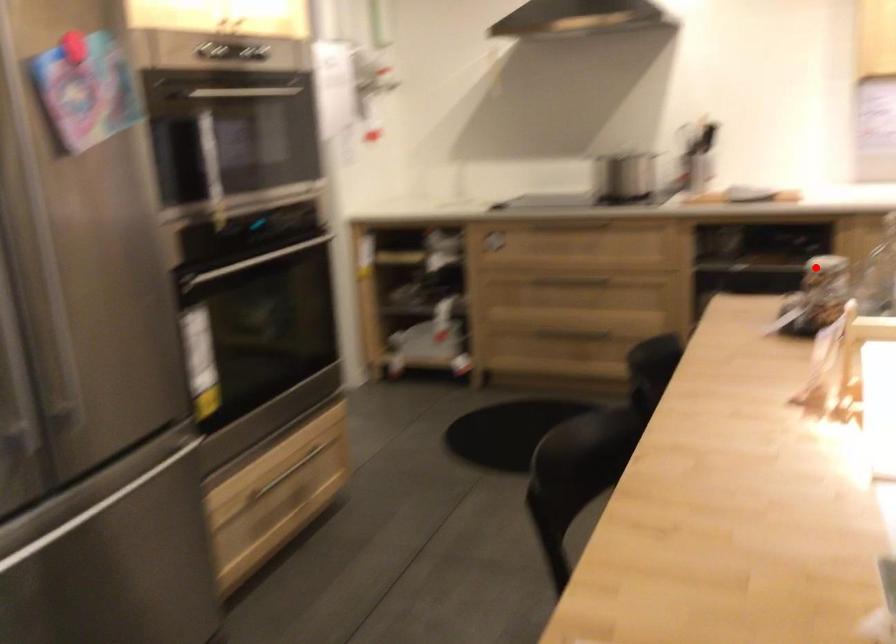
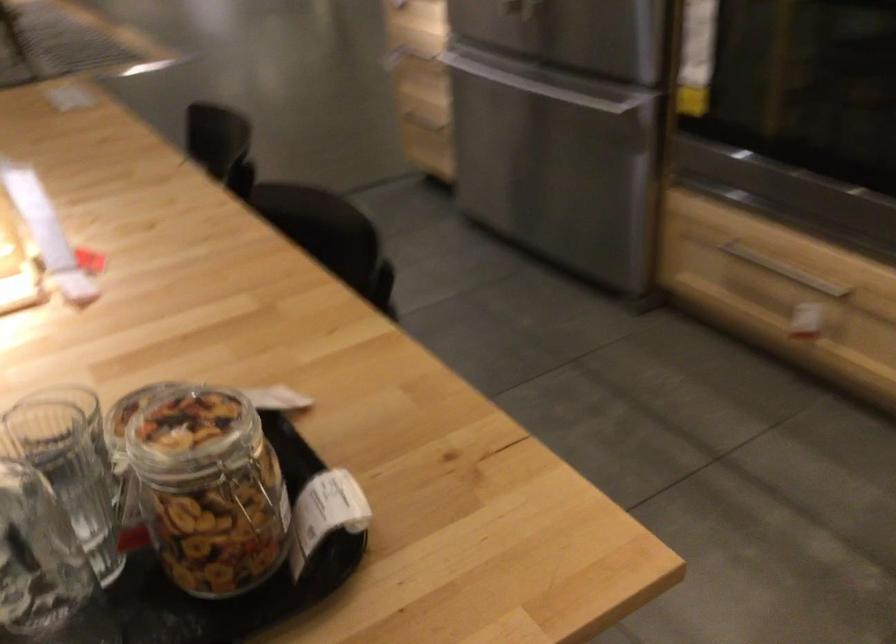
Question: I am providing you with two images of the same scene from different viewpoints. In image1, a red point is highlighted. Considering the same 3D point in image2, which of the following is correct?

Choices:
 (A) It is closer
 (B) It is farther

Answer: (A)